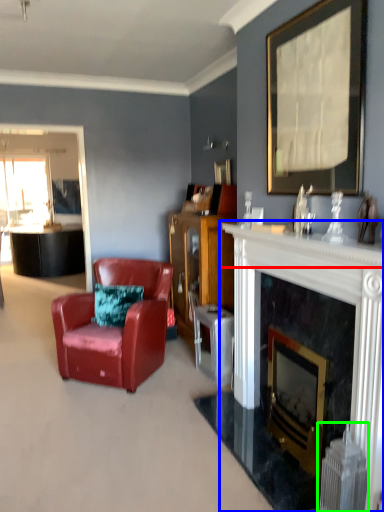
Question: Which is farther away from mantle (highlighted by a red box)? fireplace (highlighted by a blue box) or radiator (highlighted by a green box)?

Choices:
 (A) fireplace
 (B) radiator

Answer: (B)